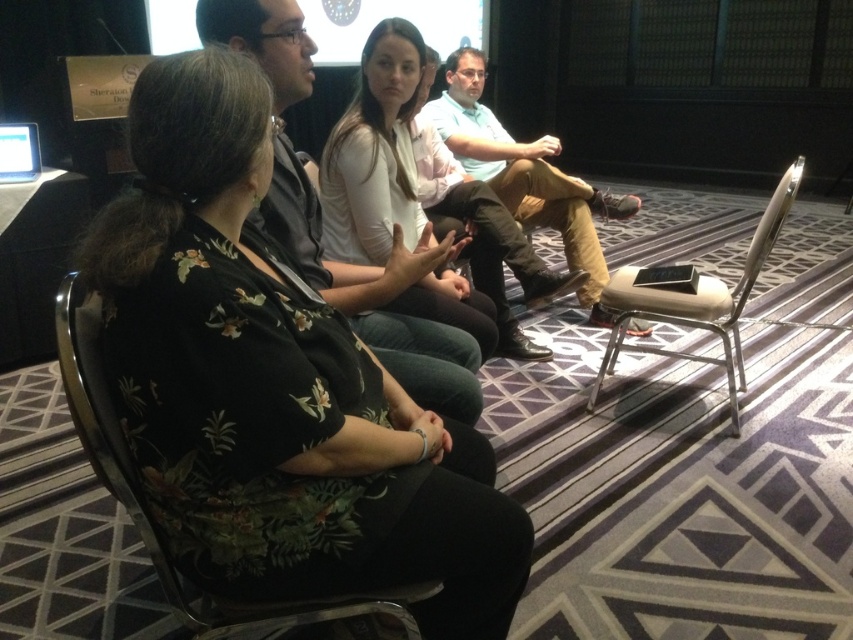
You are a person who is 5 feet tall and want to see the presentation on the matte white screen at upper center. You are currently standing behind the matte white shirt at center. Is there enough space for you to move forward so that you can see the screen clearly?

The distance between the matte white shirt at center and the matte white screen at upper center is 9.21 feet. Since you are 5 feet tall, there is sufficient space for you to move forward and see the screen clearly as the distance allows for adequate visibility.

You are organizing a small workshop and need to place a large poster on the wall behind the seating area. The poster requires a space that is the same size as the metallic silver chair at right. Is there enough space on the matte white screen at upper center to accommodate the poster?

The metallic silver chair at right is larger in size than the matte white screen at upper center. Therefore, the poster requiring the space of the metallic silver chair at right would not fit on the matte white screen at upper center.